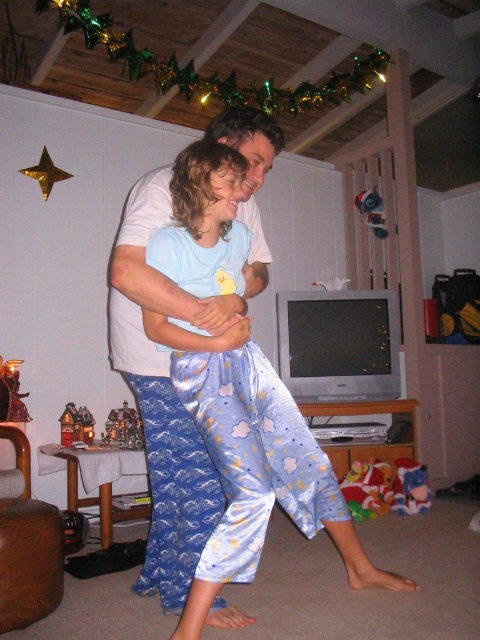
Is blue satin pajama pants at center positioned behind blue satin pajamas at center?

That is False.

Between blue satin pajama pants at center and blue satin pajamas at center, which one is positioned higher?

blue satin pajamas at center is above.

Is point (162, 269) farther from viewer compared to point (241, 116)?

No, it is not.

Where is `blue satin pajama pants at center`? Image resolution: width=480 pixels, height=640 pixels. blue satin pajama pants at center is located at coordinates (204, 221).